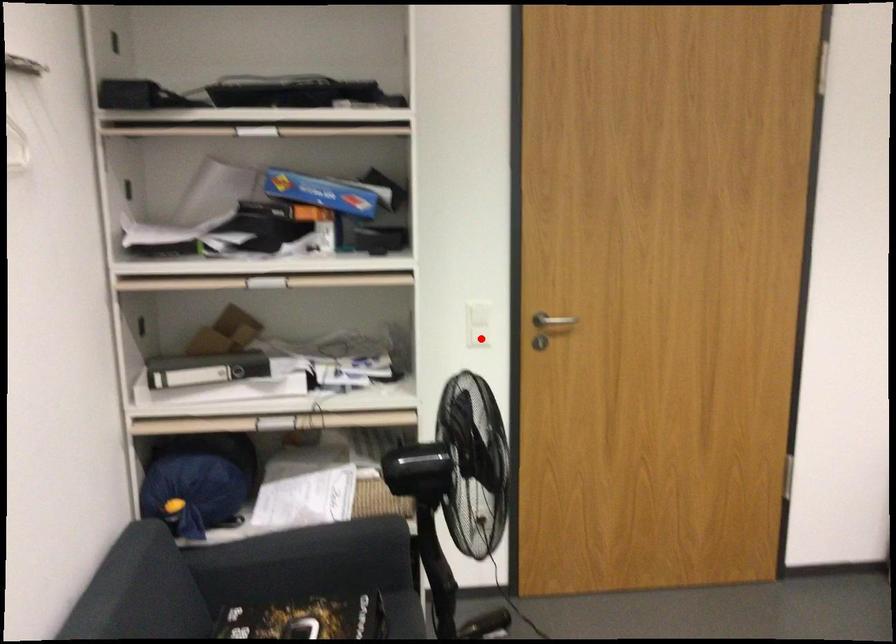
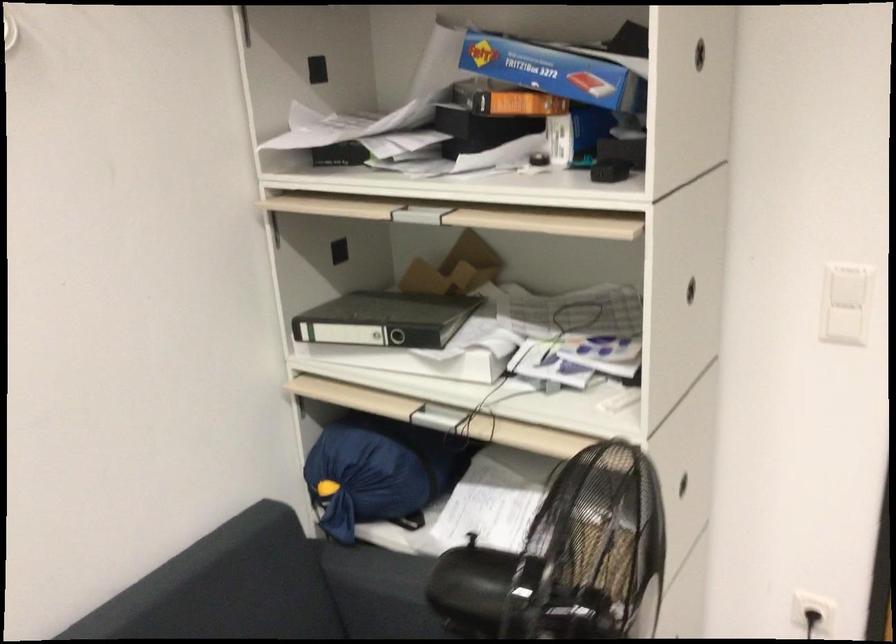
Question: I am providing you with two images of the same scene from different viewpoints. In image1, a red point is highlighted. Considering the same 3D point in image2, which of the following is correct?

Choices:
 (A) It is closer
 (B) It is farther

Answer: (A)